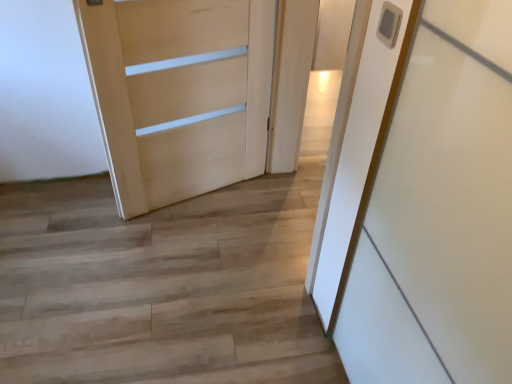
Question: Does white glossy door at center, the second door positioned from the left, have a lesser width compared to wooden floor at center?

Choices:
 (A) yes
 (B) no

Answer: (A)

Question: Are white glossy door at center, the second door positioned from the left, and wooden floor at center beside each other?

Choices:
 (A) no
 (B) yes

Answer: (A)

Question: Is wooden floor at center at the back of white glossy door at center, the 1th door positioned from the right?

Choices:
 (A) no
 (B) yes

Answer: (A)

Question: Is white glossy door at center, the 1th door positioned from the right, to the left of wooden floor at center from the viewer's perspective?

Choices:
 (A) yes
 (B) no

Answer: (B)

Question: Is point (293, 94) positioned closer to the camera than point (272, 284)?

Choices:
 (A) closer
 (B) farther

Answer: (B)

Question: From a real-world perspective, is white glossy door at center, the 1th door positioned from the right, above or below wooden floor at center?

Choices:
 (A) above
 (B) below

Answer: (A)

Question: In terms of height, does white glossy door at center, the second door positioned from the left, look taller or shorter compared to wooden floor at center?

Choices:
 (A) tall
 (B) short

Answer: (A)

Question: In terms of size, does white glossy door at center, the second door positioned from the left, appear bigger or smaller than wooden floor at center?

Choices:
 (A) small
 (B) big

Answer: (A)

Question: In terms of height, does light wood door at center, which appears as the 2th door when viewed from the right, look taller or shorter compared to wooden floor at center?

Choices:
 (A) short
 (B) tall

Answer: (B)

Question: In the image, is light wood door at center, which appears as the 2th door when viewed from the right, positioned in front of or behind wooden floor at center?

Choices:
 (A) behind
 (B) front

Answer: (A)

Question: From the image's perspective, is light wood door at center, which is the first door in left-to-right order, located above or below wooden floor at center?

Choices:
 (A) below
 (B) above

Answer: (B)

Question: Is light wood door at center, which is the first door in left-to-right order, wider or thinner than wooden floor at center?

Choices:
 (A) wide
 (B) thin

Answer: (B)

Question: From a real-world perspective, is wooden floor at center physically located above or below white glossy door at center, the second door positioned from the left?

Choices:
 (A) above
 (B) below

Answer: (B)

Question: Does point (241, 195) appear closer or farther from the camera than point (288, 21)?

Choices:
 (A) closer
 (B) farther

Answer: (B)